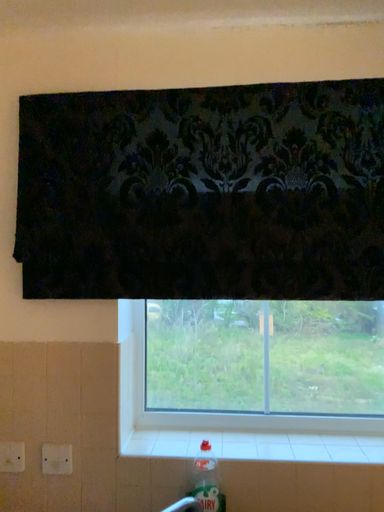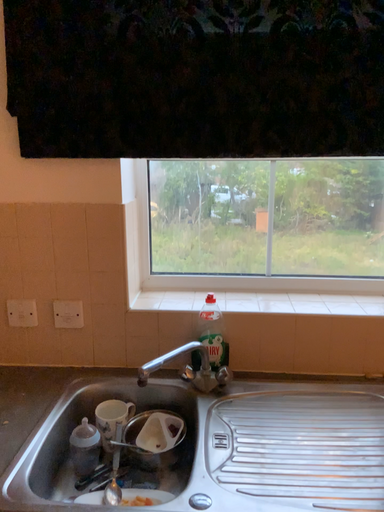
Question: How did the camera likely rotate when shooting the video?

Choices:
 (A) rotated upward
 (B) rotated downward

Answer: (B)